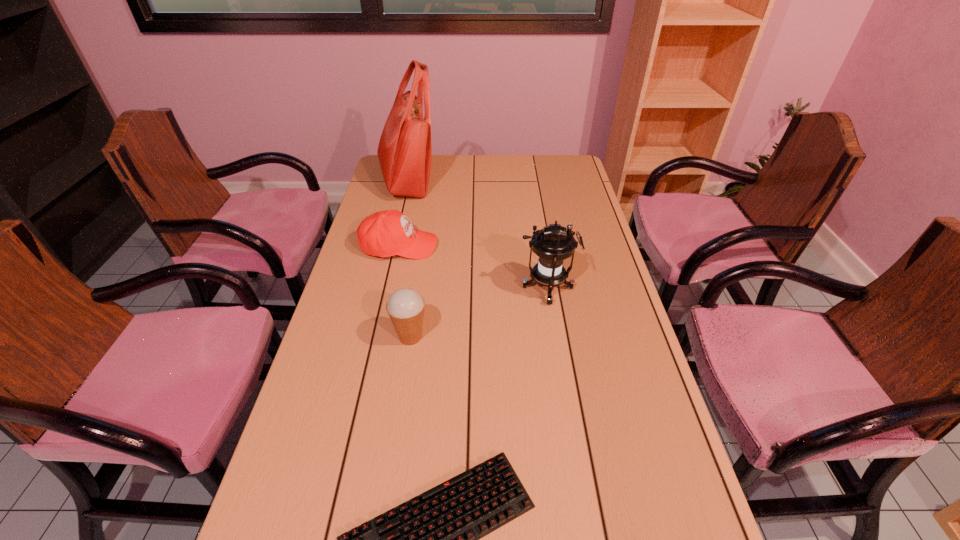
What are the coordinates of `the tallest object` in the screenshot? It's located at (405, 149).

This screenshot has width=960, height=540. Identify the location of handbag. (405, 149).

What are the coordinates of `lantern` in the screenshot? It's located at (553, 244).

I want to click on the fourth shortest object, so click(x=553, y=244).

Where is `the second nearest object`? The image size is (960, 540). the second nearest object is located at coordinates (405, 307).

You are a GUI agent. You are given a task and a screenshot of the screen. Output one action in this format:
    pyautogui.click(x=<x>, y=<y>)
    Task: Click on the third tallest object
    Image resolution: width=960 pixels, height=540 pixels.
    Given the screenshot: What is the action you would take?
    pyautogui.click(x=405, y=307)

Locate an element on the screen. Image resolution: width=960 pixels, height=540 pixels. the second shortest object is located at coordinates (386, 233).

The height and width of the screenshot is (540, 960). What are the coordinates of `the second farthest object` in the screenshot? It's located at (386, 233).

Locate an element on the screen. This screenshot has width=960, height=540. free space located 0.400m on the front-facing side of the farthest object is located at coordinates (537, 181).

What are the coordinates of `blank space located 0.100m on the back of the fourth shortest object` in the screenshot? It's located at (540, 251).